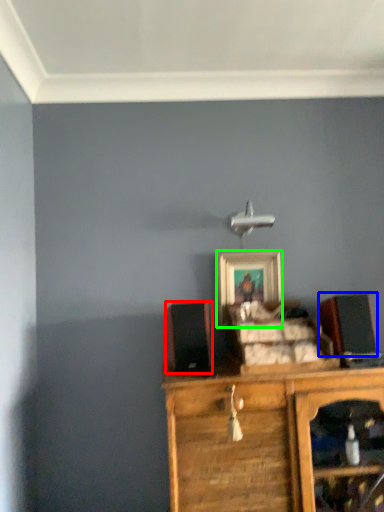
Question: Which object is the closest to the speaker (highlighted by a red box)? Choose among these: speaker (highlighted by a blue box) or picture frame (highlighted by a green box).

Choices:
 (A) speaker
 (B) picture frame

Answer: (B)